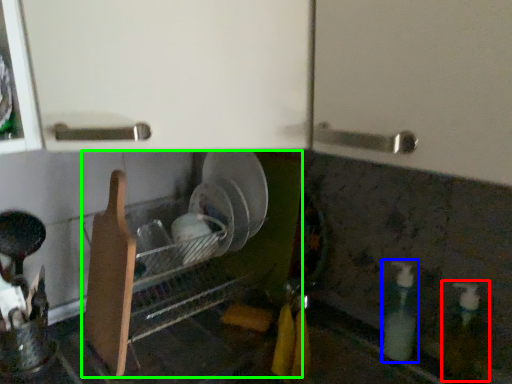
Question: Which object is positioned farthest from bottle (highlighted by a red box)? Select from bottle (highlighted by a blue box) and dish washer (highlighted by a green box).

Choices:
 (A) bottle
 (B) dish washer

Answer: (B)